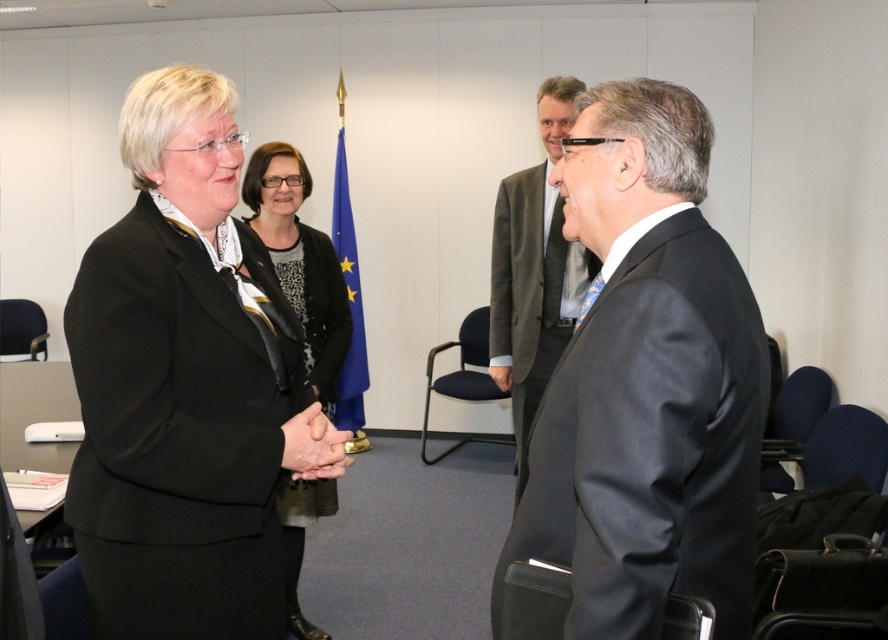
In the scene shown: Does black leather jacket at center have a smaller size compared to smooth skin handshake at center?

Incorrect, black leather jacket at center is not smaller in size than smooth skin handshake at center.

Is black leather jacket at center in front of smooth skin handshake at center?

No, black leather jacket at center is further to the viewer.

Where is `black leather jacket at center`? black leather jacket at center is located at coordinates (300, 260).

Locate an element on the screen. black suit at center is located at coordinates (646, 384).

Can you confirm if black suit at center is bigger than blue fabric flag at center?

No.

Measure the distance between black suit at center and camera.

black suit at center and camera are 38.22 inches apart from each other.

What are the coordinates of `black suit at center` in the screenshot? It's located at (646, 384).

Does black matte suit at center appear on the right side of black leather jacket at center?

Correct, you'll find black matte suit at center to the right of black leather jacket at center.

Can you confirm if black matte suit at center is thinner than black leather jacket at center?

No.

Between point (163, 134) and point (288, 272), which one is positioned in front?

Positioned in front is point (163, 134).

Image resolution: width=888 pixels, height=640 pixels. What are the coordinates of `black matte suit at center` in the screenshot? It's located at (181, 385).